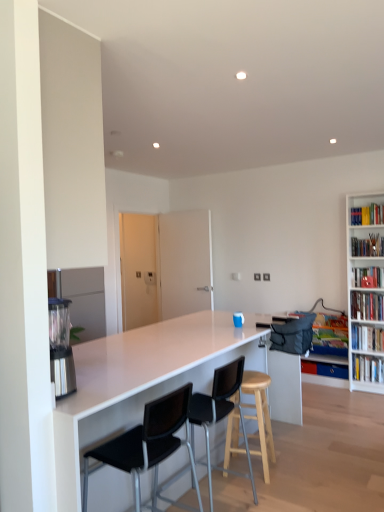
Identify the location of free space in front of light wood stool at center. (264, 492).